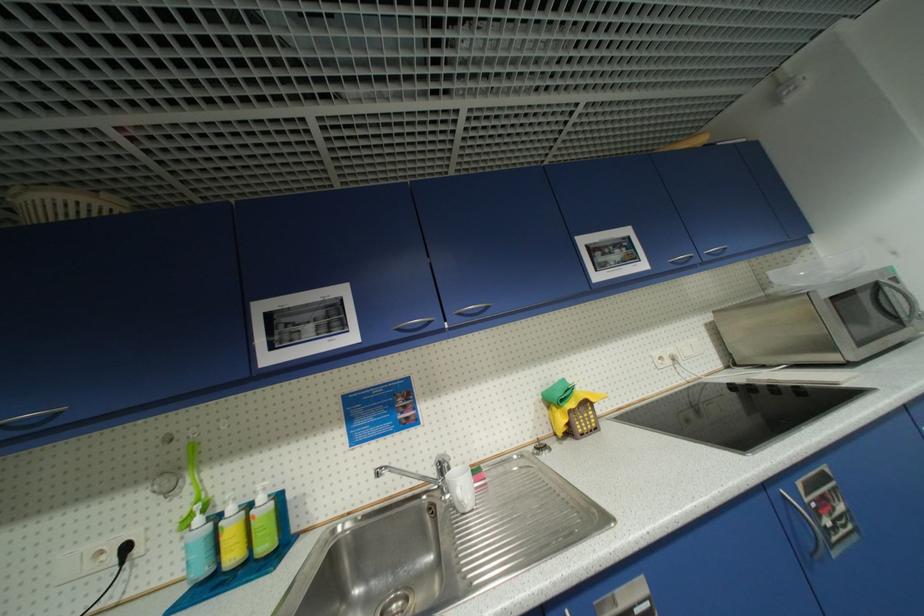
What are the coordinates of `microwave door handle` in the screenshot? It's located at (904, 299).